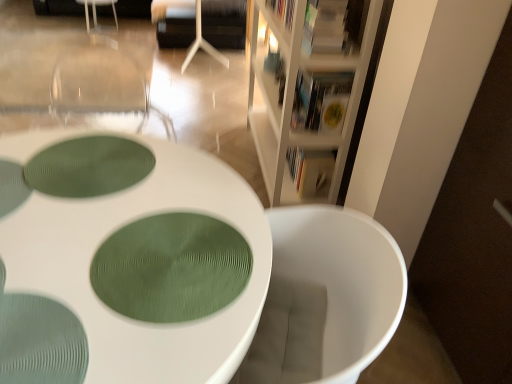
What do you see at coordinates (170, 268) in the screenshot?
I see `green textured oval at center, the 1th oval from the bottom` at bounding box center [170, 268].

This screenshot has width=512, height=384. I want to click on white textured table at center, so click(x=125, y=261).

Image resolution: width=512 pixels, height=384 pixels. Describe the element at coordinates (321, 100) in the screenshot. I see `hardcover book at upper center, the 2th book positioned from the bottom` at that location.

Locate an element on the screen. This screenshot has height=384, width=512. matte white book at upper right, the third book from the bottom is located at coordinates (329, 27).

Measure the distance between point (331, 162) and camera.

Point (331, 162) and camera are 7.12 feet apart from each other.

This screenshot has width=512, height=384. I want to click on white wood bookcase at upper right, so click(306, 89).

The image size is (512, 384). What are the coordinates of `green textured oval at center, which ranks as the second oval in top-to-bottom order` in the screenshot? It's located at (170, 268).

Between green textured oval at center, which ranks as the second oval in top-to-bottom order, and hardcover book at upper center, the 2th book in the back-to-front sequence, which one has larger size?

hardcover book at upper center, the 2th book in the back-to-front sequence.

Does green textured oval at center, which ranks as the second oval in top-to-bottom order, touch hardcover book at upper center, the second book from the front?

No, green textured oval at center, which ranks as the second oval in top-to-bottom order, is not beside hardcover book at upper center, the second book from the front.

From a real-world perspective, between green textured oval at center, the 1th oval from the bottom, and hardcover book at upper center, the second book from the front, who is vertically lower?

hardcover book at upper center, the second book from the front, from a real-world perspective.

From the image's perspective, is green textured oval at center, which ranks as the second oval in top-to-bottom order, positioned above or below hardcover book at upper center, the second book from the front?

Based on their image positions, green textured oval at center, which ranks as the second oval in top-to-bottom order, is located beneath hardcover book at upper center, the second book from the front.

Is green textured placemat at center, which is counted as the first oval, starting from the top, oriented away from white wood bookcase at upper right?

No, green textured placemat at center, which is counted as the first oval, starting from the top, is not facing away from white wood bookcase at upper right.

How different are the orientations of green textured placemat at center, which is counted as the first oval, starting from the top, and white wood bookcase at upper right in degrees?

107 degrees separate the facing orientations of green textured placemat at center, which is counted as the first oval, starting from the top, and white wood bookcase at upper right.

From a real-world perspective, does green textured placemat at center, the 1th oval positioned from the back, sit lower than white wood bookcase at upper right?

No.

Is point (87, 185) less distant than point (278, 88)?

Yes.

Does point (335, 120) come behind point (339, 112)?

Yes, point (335, 120) is behind point (339, 112).

Does hardcover book at upper center, the 2th book positioned from the bottom, appear on the left side of white wood bookcase at upper right?

No.

How much distance is there between hardcover book at upper center, the 2th book positioned from the bottom, and white wood bookcase at upper right?

hardcover book at upper center, the 2th book positioned from the bottom, and white wood bookcase at upper right are 9.06 inches apart.

From a real-world perspective, which object stands above the other?

hardcover book at upper center, the second book from the front, from a real-world perspective.

Considering the points (313, 36) and (317, 108), which point is in front, point (313, 36) or point (317, 108)?

The point (317, 108) is closer.

From a real-world perspective, is matte white book at upper right, placed as the 1th book when sorted from top to bottom, positioned above or below hardcover book at upper center, the 2th book in the back-to-front sequence?

From a real-world perspective, matte white book at upper right, placed as the 1th book when sorted from top to bottom, is physically above hardcover book at upper center, the 2th book in the back-to-front sequence.

Are matte white book at upper right, which is the third book from back to front, and hardcover book at upper center, the second book from the front, far apart?

No, matte white book at upper right, which is the third book from back to front, is not far from hardcover book at upper center, the second book from the front.

From the image's perspective, would you say matte white book at upper right, acting as the 1th book starting from the front, is shown under hardcover book at upper center, the second book from the front?

Actually, matte white book at upper right, acting as the 1th book starting from the front, appears above hardcover book at upper center, the second book from the front, in the image.

Does point (298, 171) come farther from viewer compared to point (362, 47)?

Yes, it is behind point (362, 47).

From a real-world perspective, is hardcover book at center, arranged as the 1th book when ordered from the bottom, positioned under white wood bookcase at upper right based on gravity?

Yes, from a real-world perspective, hardcover book at center, arranged as the 1th book when ordered from the bottom, is beneath white wood bookcase at upper right.

From the image's perspective, relative to white wood bookcase at upper right, is hardcover book at center, the first book viewed from the back, above or below?

hardcover book at center, the first book viewed from the back, is situated lower than white wood bookcase at upper right in the image.

Is green textured oval at center, which ranks as the second oval in top-to-bottom order, next to white wood bookcase at upper right?

No, green textured oval at center, which ranks as the second oval in top-to-bottom order, is not making contact with white wood bookcase at upper right.

From the picture: Which object is positioned more to the right, green textured oval at center, marked as the 1th oval in a front-to-back arrangement, or white wood bookcase at upper right?

Positioned to the right is white wood bookcase at upper right.

From a real-world perspective, is green textured oval at center, which appears as the 2th oval when viewed from the back, positioned above or below white wood bookcase at upper right?

green textured oval at center, which appears as the 2th oval when viewed from the back, is situated higher than white wood bookcase at upper right in the real world.

Which is behind, point (213, 256) or point (315, 82)?

The point (315, 82) is more distant.

Is the position of hardcover book at upper center, which is counted as the 2th book, starting from the top, less distant than that of hardcover book at center, arranged as the 1th book when ordered from the bottom?

Yes, it is.

Considering the relative sizes of hardcover book at upper center, the 2th book in the back-to-front sequence, and hardcover book at center, the first book viewed from the back, in the image provided, is hardcover book at upper center, the 2th book in the back-to-front sequence, smaller than hardcover book at center, the first book viewed from the back,?

Yes, hardcover book at upper center, the 2th book in the back-to-front sequence, is smaller than hardcover book at center, the first book viewed from the back.

From a real-world perspective, is hardcover book at upper center, the 2th book in the back-to-front sequence, located higher than hardcover book at center, arranged as the 1th book when ordered from the bottom?

Indeed, from a real-world perspective, hardcover book at upper center, the 2th book in the back-to-front sequence, stands above hardcover book at center, arranged as the 1th book when ordered from the bottom.

From the image's perspective, starting from the hardcover book at upper center, which is counted as the 2th book, starting from the top, which oval is the 2nd one below? Please provide its 2D coordinates.

[(170, 268)]

Find the location of a particular element. The width and height of the screenshot is (512, 384). bookcase lying behind the green textured placemat at center, the 1th oval positioned from the back is located at coordinates (306, 89).

When comparing their distances from white matte armchair at upper center, does matte white book at upper right, placed as the 1th book when sorted from top to bottom, or white textured table at center seem further?

Among the two, white textured table at center is located further to white matte armchair at upper center.

When comparing their distances from green textured oval at center, marked as the 1th oval in a front-to-back arrangement, does white textured table at center or hardcover book at center, arranged as the 1th book when ordered from the bottom, seem further?

The object further to green textured oval at center, marked as the 1th oval in a front-to-back arrangement, is hardcover book at center, arranged as the 1th book when ordered from the bottom.

Looking at the image, which one is located further to hardcover book at center, the third book in the front-to-back sequence, white matte armchair at upper center or white textured table at center?

white matte armchair at upper center is further to hardcover book at center, the third book in the front-to-back sequence.

Considering their positions, is hardcover book at center, arranged as the third book when viewed from the top, positioned closer to white textured table at center than white matte armchair at upper center?

Based on the image, hardcover book at center, arranged as the third book when viewed from the top, appears to be nearer to white textured table at center.

From the image, which object appears to be farther from green textured oval at center, marked as the 1th oval in a front-to-back arrangement, matte white book at upper right, placed as the 1th book when sorted from top to bottom, or green textured placemat at center, the 1th oval positioned from the back?

matte white book at upper right, placed as the 1th book when sorted from top to bottom, lies further to green textured oval at center, marked as the 1th oval in a front-to-back arrangement, than the other object.

Looking at the image, which one is located further to white textured table at center, green textured placemat at center, the second oval when ordered from front to back, or matte white book at upper right, placed as the 1th book when sorted from top to bottom?

The object further to white textured table at center is matte white book at upper right, placed as the 1th book when sorted from top to bottom.

Looking at this image, which object lies further to the anchor point hardcover book at upper center, which is counted as the 2th book, starting from the top, green textured placemat at center, placed as the 2th oval when sorted from bottom to top, or green textured oval at center, which ranks as the second oval in top-to-bottom order?

green textured oval at center, which ranks as the second oval in top-to-bottom order.

In the scene shown: From the image, which object appears to be farther from hardcover book at center, arranged as the 1th book when ordered from the bottom, green textured placemat at center, the second oval when ordered from front to back, or white textured table at center?

white textured table at center.

You are a GUI agent. You are given a task and a screenshot of the screen. Output one action in this format:
    pyautogui.click(x=<x>, y=<y>)
    Task: Click on the bookcase between green textured placemat at center, which is counted as the first oval, starting from the top, and hardcover book at center, the third book in the front-to-back sequence, in the front-back direction
    The height and width of the screenshot is (384, 512).
    Given the screenshot: What is the action you would take?
    pyautogui.click(x=306, y=89)

Locate an element on the screen. The width and height of the screenshot is (512, 384). bookcase located between green textured oval at center, marked as the 1th oval in a front-to-back arrangement, and white matte armchair at upper center in the depth direction is located at coordinates coord(306,89).

This screenshot has height=384, width=512. Identify the location of oval between white textured table at center and green textured placemat at center, the 1th oval positioned from the back, from front to back. (170, 268).

Locate an element on the screen. oval between white wood bookcase at upper right and green textured oval at center, which ranks as the second oval in top-to-bottom order, in the vertical direction is located at coordinates (89, 166).